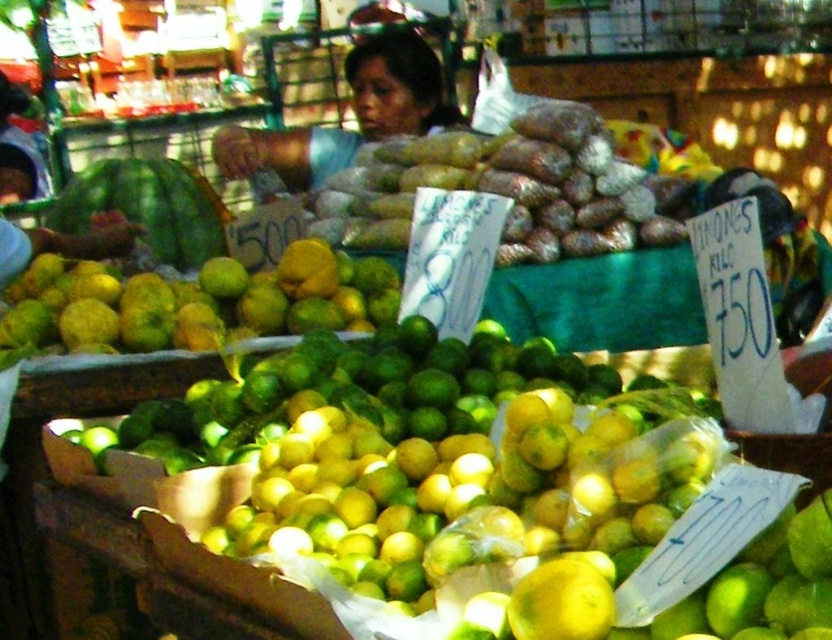
Is the position of yellow matte citrus at center less distant than that of yellow matte lemon at center?

No, yellow matte citrus at center is further to the viewer.

Can you confirm if yellow matte citrus at center is taller than yellow matte lemon at center?

Correct, yellow matte citrus at center is much taller as yellow matte lemon at center.

Is point (229, 342) more distant than point (588, 576)?

Yes, point (229, 342) is behind point (588, 576).

Locate an element on the screen. The width and height of the screenshot is (832, 640). yellow matte citrus at center is located at coordinates (189, 304).

Based on the photo, can you confirm if yellow matte citrus at center is taller than blue fabric shirt at center?

Incorrect, yellow matte citrus at center's height is not larger of blue fabric shirt at center's.

Which of these two, yellow matte citrus at center or blue fabric shirt at center, stands taller?

blue fabric shirt at center

At what (x,y) coordinates should I click in order to perform the action: click on yellow matte citrus at center. Please return your answer as a coordinate pair (x, y). Looking at the image, I should click on point(189,304).

Does blue fabric shirt at center appear over yellow matte lemon at center?

Correct, blue fabric shirt at center is located above yellow matte lemon at center.

Does blue fabric shirt at center appear on the right side of yellow matte lemon at center?

In fact, blue fabric shirt at center is to the left of yellow matte lemon at center.

Which is behind, point (385, 86) or point (607, 618)?

Point (385, 86)

Where is `blue fabric shirt at center`? The image size is (832, 640). blue fabric shirt at center is located at coordinates point(353,112).